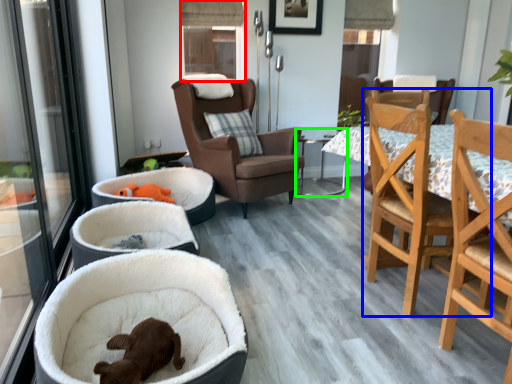
Question: Based on their relative distances, which object is nearer to window (highlighted by a red box)? Choose from chair (highlighted by a blue box) and table (highlighted by a green box).

Choices:
 (A) chair
 (B) table

Answer: (B)